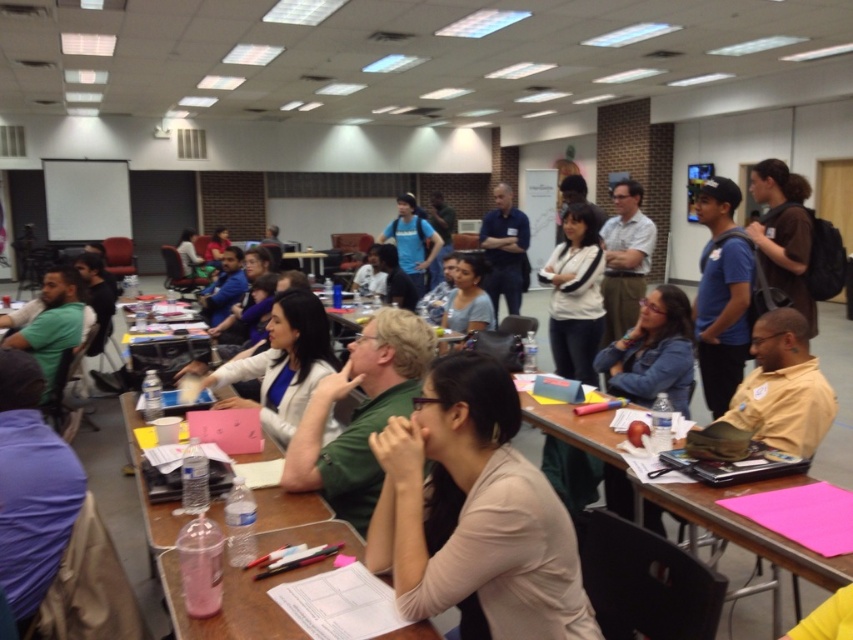
Can you confirm if brown wooden table at lower right is shorter than white glossy shirt at center?

Yes.

Is point (817, 582) more distant than point (258, 412)?

No.

Which is behind, point (722, 518) or point (312, 339)?

The point (312, 339) is behind.

Locate an element on the screen. brown wooden table at lower right is located at coordinates (749, 528).

Describe the element at coordinates (251, 611) in the screenshot. I see `clear plastic tray at center` at that location.

Can you confirm if clear plastic tray at center is thinner than white glossy shirt at center?

Incorrect, clear plastic tray at center's width is not less than white glossy shirt at center's.

Locate an element on the screen. Image resolution: width=853 pixels, height=640 pixels. clear plastic tray at center is located at coordinates (251, 611).

Does clear plastic tray at center come in front of brown wooden table at lower right?

Yes, it is in front of brown wooden table at lower right.

Does clear plastic tray at center have a lesser width compared to brown wooden table at lower right?

Incorrect, clear plastic tray at center's width is not less than brown wooden table at lower right's.

Which is behind, point (141, 499) or point (838, 577)?

The point (141, 499) is more distant.

At what (x,y) coordinates should I click in order to perform the action: click on clear plastic tray at center. Please return your answer as a coordinate pair (x, y). This screenshot has height=640, width=853. Looking at the image, I should click on (251, 611).